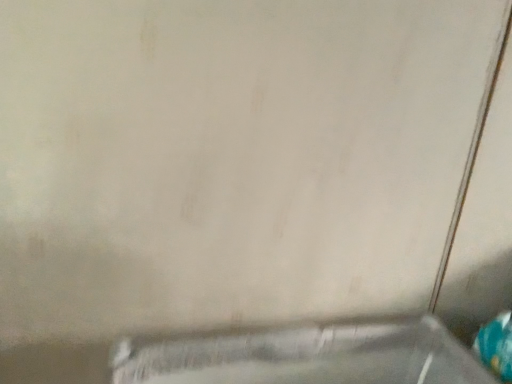
The image size is (512, 384). What are the coordinates of `blue glossy bottle at lower right` in the screenshot? It's located at (496, 346).

What do you see at coordinates (496, 346) in the screenshot?
I see `blue glossy bottle at lower right` at bounding box center [496, 346].

Identify the location of blue glossy bottle at lower right. The height and width of the screenshot is (384, 512). (496, 346).